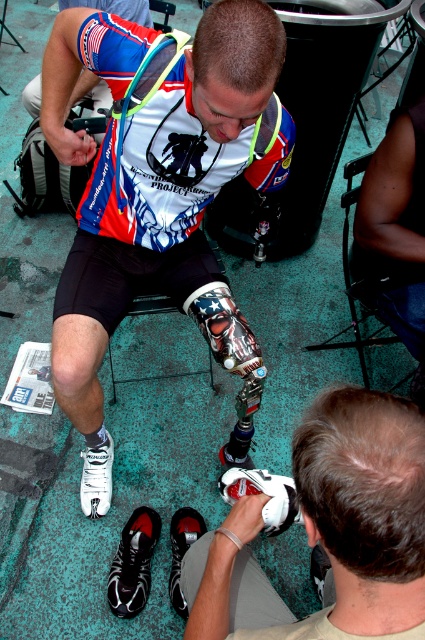
Question: Among these objects, which one is farthest from the camera?

Choices:
 (A) black leather shoe at lower center
 (B) white matte prosthetic leg at lower center
 (C) white matte shoe at lower left
 (D) white matte shoe at lower center

Answer: (C)

Question: Which is nearer to the black mesh shoe at lower left?

Choices:
 (A) black leather shoe at lower center
 (B) metallic prosthetic leg at center
 (C) white matte shoe at lower left
 (D) white matte prosthetic leg at lower center

Answer: (A)

Question: Observing the image, what is the correct spatial positioning of black mesh shoe at lower left in reference to white matte shoe at lower center?

Choices:
 (A) below
 (B) above

Answer: (A)

Question: Observing the image, what is the correct spatial positioning of black mesh shoe at lower left in reference to white matte shoe at lower left?

Choices:
 (A) left
 (B) right

Answer: (B)

Question: Which object appears farthest from the camera in this image?

Choices:
 (A) metallic prosthetic leg at center
 (B) white matte shoe at lower center

Answer: (B)

Question: Does metallic prosthetic leg at center appear on the left side of black mesh shoe at lower left?

Choices:
 (A) no
 (B) yes

Answer: (A)